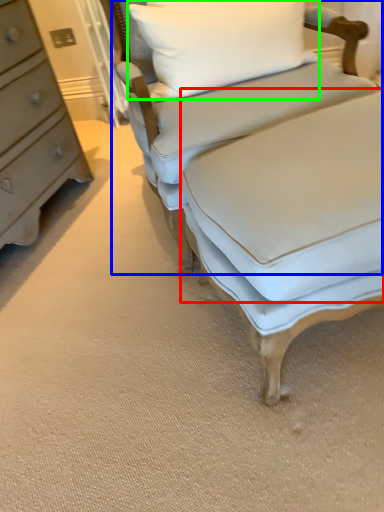
Question: Based on their relative distances, which object is farther from sheet (highlighted by a red box)? Choose from studio couch (highlighted by a blue box) and pillow (highlighted by a green box).

Choices:
 (A) studio couch
 (B) pillow

Answer: (B)